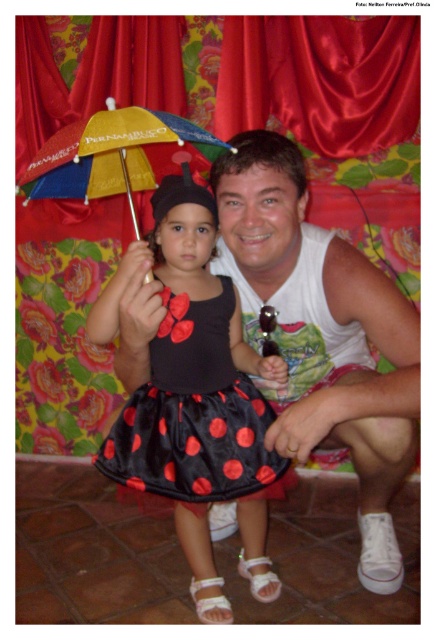
Question: Among these objects, which one is farthest from the camera?

Choices:
 (A) black satin dress at center
 (B) multicolored fabric umbrella at upper left

Answer: (A)

Question: Which is nearer to the black satin dress at center?

Choices:
 (A) multicolored fabric umbrella at upper left
 (B) white cotton tank top at center

Answer: (B)

Question: Observing the image, what is the correct spatial positioning of white cotton tank top at center in reference to multicolored fabric umbrella at upper left?

Choices:
 (A) left
 (B) right

Answer: (B)

Question: Is the position of black satin dress at center less distant than that of multicolored fabric umbrella at upper left?

Choices:
 (A) yes
 (B) no

Answer: (B)

Question: Does white cotton tank top at center lie behind multicolored fabric umbrella at upper left?

Choices:
 (A) yes
 (B) no

Answer: (A)

Question: Which of the following is the farthest from the observer?

Choices:
 (A) multicolored fabric umbrella at upper left
 (B) white cotton tank top at center
 (C) black satin dress at center

Answer: (C)